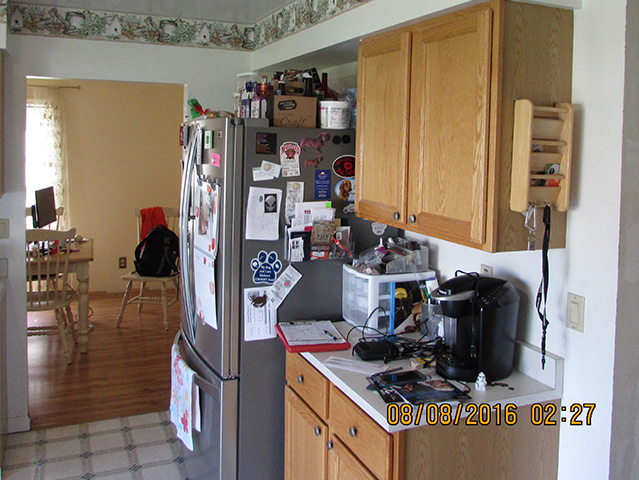
Identify the location of chair. (148, 281), (43, 305).